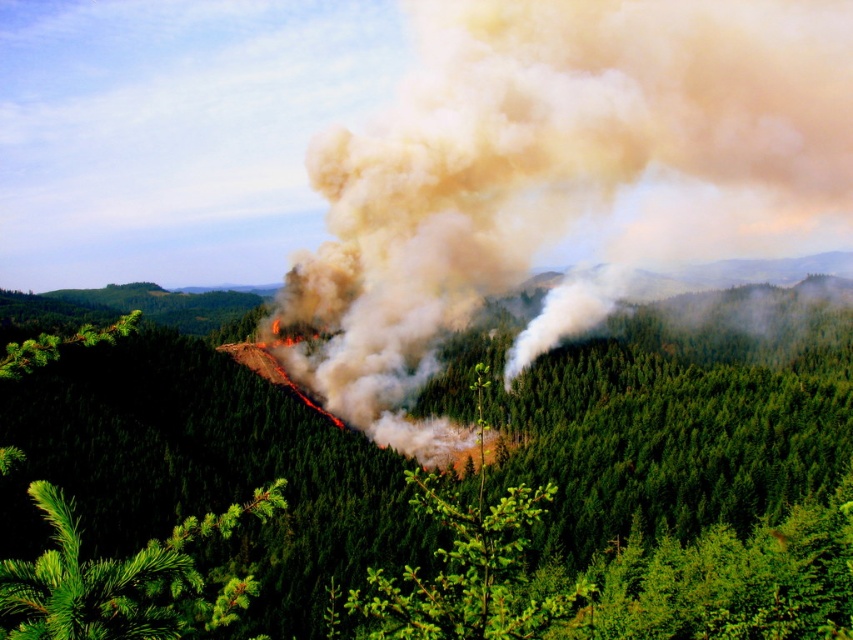
Based on the coordinates provided in the description, where exactly is the smoke cloud at center located in the image?

The smoke cloud at center is located at coordinates point [561,176].